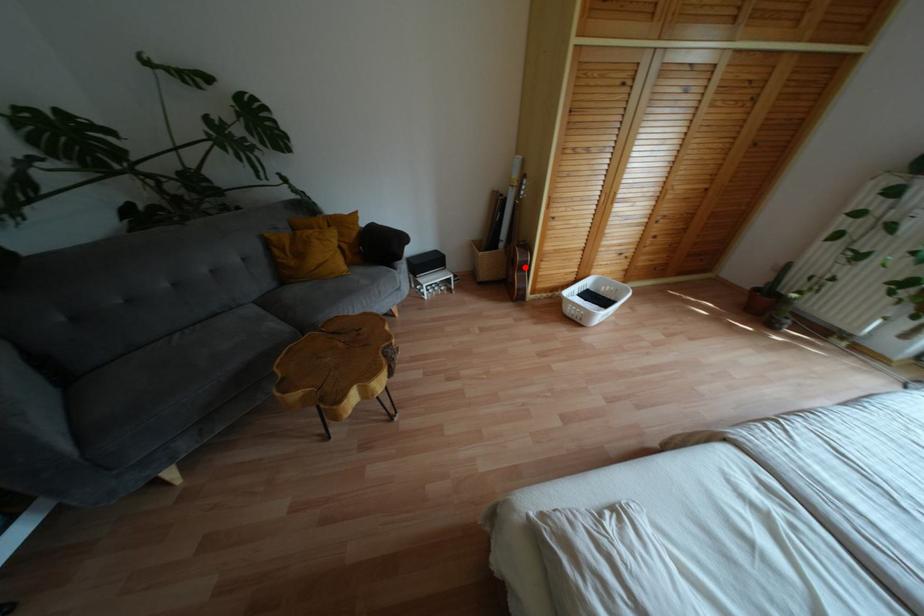
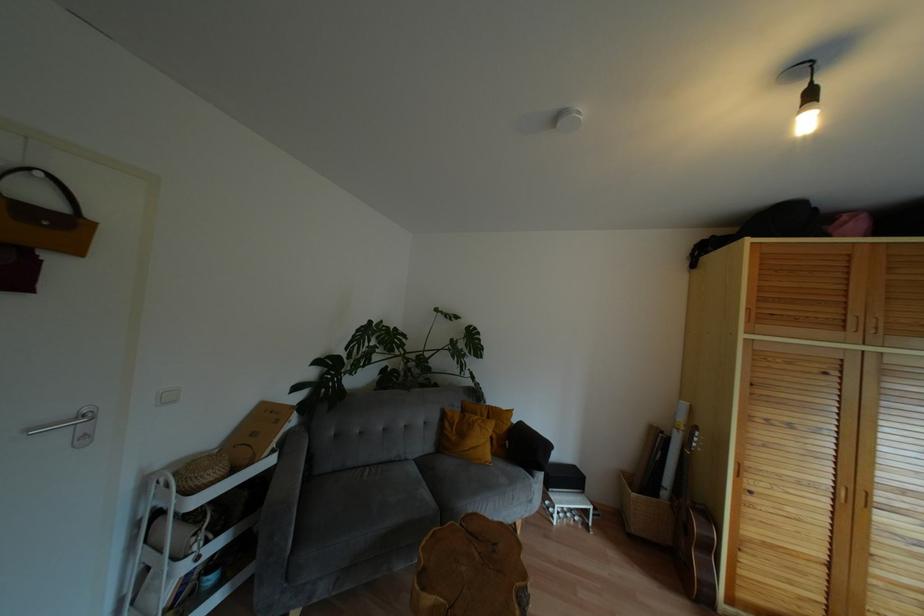
Question: I am providing you with two images of the same scene from different viewpoints. Image1 has a red point marked. In image2, the corresponding 3D location appears at what relative position? Reply with the corresponding letter.

Choices:
 (A) Closer
 (B) Farther

Answer: (A)